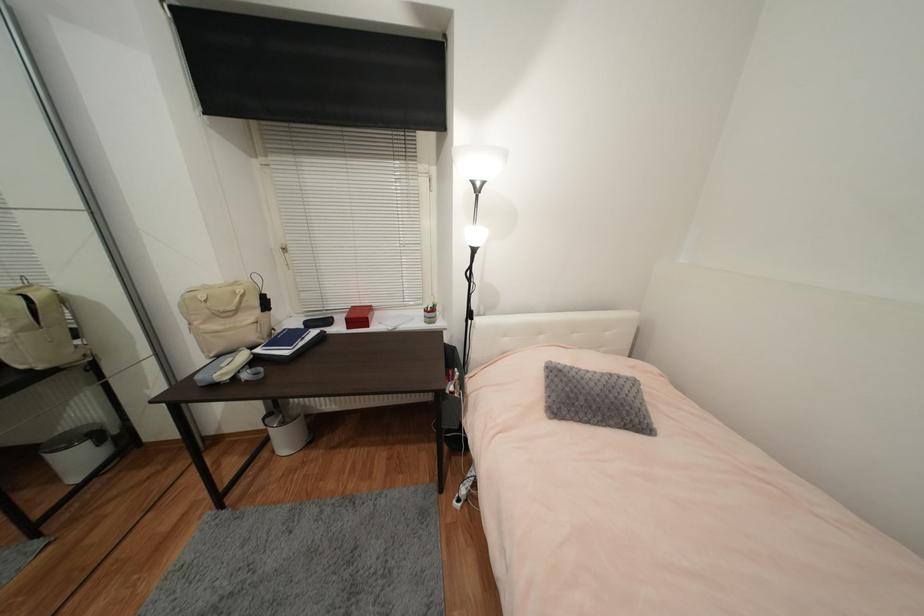
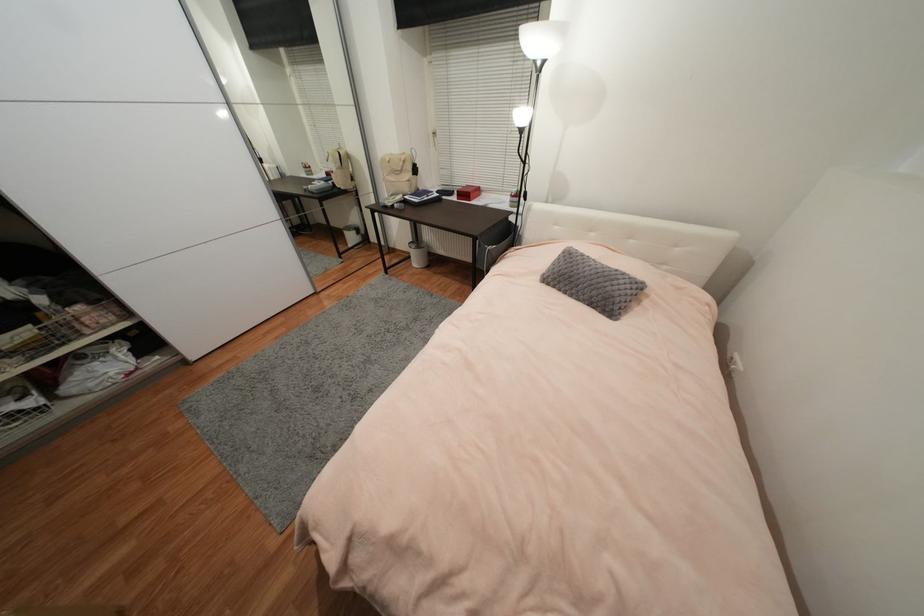
The point at (257, 339) is marked in the first image. Where is the corresponding point in the second image?

(410, 191)